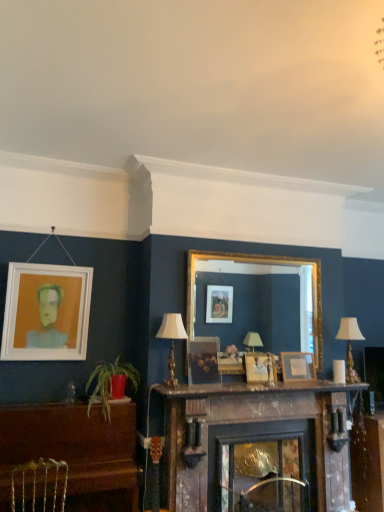
How much space does wooden picture frame at center, which is the third picture frame from left to right, occupy vertically?

wooden picture frame at center, which is the third picture frame from left to right, is 12.97 inches tall.

Describe the element at coordinates (172, 341) in the screenshot. I see `white fabric lampshade at center, which appears as the first lamp when viewed from the front` at that location.

In order to face matte wooden picture frame at center, the third picture frame in the right-to-left sequence, should I rotate leftwards or rightwards?

Turn right by 1.745 degrees to look at matte wooden picture frame at center, the third picture frame in the right-to-left sequence.

Describe the element at coordinates (75, 451) in the screenshot. The width and height of the screenshot is (384, 512). I see `brown polished piano at lower left` at that location.

Describe the element at coordinates (109, 382) in the screenshot. I see `green leafy plant at lower left` at that location.

Measure the distance between point (282,509) and camera.

A distance of 3.51 meters exists between point (282,509) and camera.

Where is `wooden mantle at center`? wooden mantle at center is located at coordinates [x=255, y=389].

Identify the location of swivel chair below the green leafy plant at lower left (from a real-world perspective). The width and height of the screenshot is (384, 512). (39, 486).

Is green leafy plant at lower left spatially inside metallic silver swivel chair at lower left, or outside of it?

green leafy plant at lower left is not inside metallic silver swivel chair at lower left, it's outside.

Does green leafy plant at lower left have a lesser width compared to metallic silver swivel chair at lower left?

In fact, green leafy plant at lower left might be wider than metallic silver swivel chair at lower left.

Is matte wooden picture frame at center, which is counted as the 2th picture frame, starting from the left, behind wooden picture frame at center, the 4th picture frame in the left-to-right sequence?

No, it is not.

The image size is (384, 512). There is a wooden picture frame at center, the 4th picture frame in the left-to-right sequence. In order to click on the 1st picture frame above it (from a real-world perspective) in this screenshot , I will do `click(203, 360)`.

Looking at this image, is matte wooden picture frame at center, the third picture frame in the right-to-left sequence, positioned far away from wooden picture frame at center, the 4th picture frame in the left-to-right sequence?

matte wooden picture frame at center, the third picture frame in the right-to-left sequence, is near wooden picture frame at center, the 4th picture frame in the left-to-right sequence, not far away.

Is matte wooden picture frame at center, the third picture frame in the right-to-left sequence, to the right of wooden mantle at center from the viewer's perspective?

No, matte wooden picture frame at center, the third picture frame in the right-to-left sequence, is not to the right of wooden mantle at center.

Looking at this image, from a real-world perspective, which object stands above the other?

matte wooden picture frame at center, the third picture frame in the right-to-left sequence.

Is matte wooden picture frame at center, which is counted as the 2th picture frame, starting from the left, facing away from wooden mantle at center?

matte wooden picture frame at center, which is counted as the 2th picture frame, starting from the left, is not turned away from wooden mantle at center.

From the image's perspective, starting from the wooden mantle at center, which picture frame is the 3rd one above? Please provide its 2D coordinates.

[(203, 360)]

Is white fabric lampshade at center, acting as the 1th lamp starting from the left, positioned with its back to wooden picture frame at center, which is the third picture frame from left to right?

No, white fabric lampshade at center, acting as the 1th lamp starting from the left,'s orientation is not away from wooden picture frame at center, which is the third picture frame from left to right.

Can you confirm if white fabric lampshade at center, which appears as the first lamp when viewed from the front, is taller than wooden picture frame at center, arranged as the 2th picture frame when viewed from the right?

Yes.

Which is more to the left, white fabric lampshade at center, which appears as the first lamp when viewed from the front, or wooden picture frame at center, arranged as the 2th picture frame when viewed from the right?

white fabric lampshade at center, which appears as the first lamp when viewed from the front, is more to the left.

Based on the photo, is white fabric lampshade at center, acting as the 1th lamp starting from the left, thinner than wooden picture frame at center, arranged as the 2th picture frame when viewed from the right?

No, white fabric lampshade at center, acting as the 1th lamp starting from the left, is not thinner than wooden picture frame at center, arranged as the 2th picture frame when viewed from the right.

Considering the points (183, 330) and (286, 370), which point is in front, point (183, 330) or point (286, 370)?

The point (183, 330) is in front.

Is white fabric lampshade at center, which appears as the first lamp when viewed from the front, next to wooden picture frame at center, positioned as the 1th picture frame in right-to-left order?

They are not placed beside each other.

Starting from the white fabric lampshade at center, acting as the 1th lamp starting from the left, which picture frame is the 3rd one to the right? Please provide its 2D coordinates.

[(297, 367)]

Which object is further away from the camera, white fabric lampshade at center, which appears as the first lamp when viewed from the front, or wooden picture frame at center, the 4th picture frame in the left-to-right sequence?

wooden picture frame at center, the 4th picture frame in the left-to-right sequence, is behind.

Which is correct: white fabric lampshade at right, the second lamp viewed from the left, is inside wooden mantle at center, or outside of it?

white fabric lampshade at right, the second lamp viewed from the left, is located beyond the bounds of wooden mantle at center.

Is white fabric lampshade at right, the 1th lamp when ordered from back to front, next to wooden mantle at center?

No, white fabric lampshade at right, the 1th lamp when ordered from back to front, is not in contact with wooden mantle at center.

Is white fabric lampshade at right, the 2th lamp when ordered from front to back, bigger than wooden mantle at center?

Incorrect, white fabric lampshade at right, the 2th lamp when ordered from front to back, is not larger than wooden mantle at center.

Measure the distance between white fabric lampshade at right, the 2th lamp when ordered from front to back, and wooden mantle at center.

white fabric lampshade at right, the 2th lamp when ordered from front to back, is 80.66 centimeters from wooden mantle at center.

Considering the sizes of objects matte wooden picture frame at center, the third picture frame in the right-to-left sequence, and green leafy plant at lower left in the image provided, who is thinner, matte wooden picture frame at center, the third picture frame in the right-to-left sequence, or green leafy plant at lower left?

With smaller width is matte wooden picture frame at center, the third picture frame in the right-to-left sequence.

Between matte wooden picture frame at center, the third picture frame in the right-to-left sequence, and green leafy plant at lower left, which one appears on the left side from the viewer's perspective?

green leafy plant at lower left.

Between point (218, 344) and point (97, 365), which one is positioned behind?

The point (218, 344) is behind.

Based on the photo, from a real-world perspective, is matte wooden picture frame at center, the third picture frame in the right-to-left sequence, under green leafy plant at lower left?

No, from a real-world perspective, matte wooden picture frame at center, the third picture frame in the right-to-left sequence, is not beneath green leafy plant at lower left.

Where is `swivel chair lying below the green leafy plant at lower left (from the image's perspective)`? The width and height of the screenshot is (384, 512). swivel chair lying below the green leafy plant at lower left (from the image's perspective) is located at coordinates (39, 486).

What are the coordinates of `picture frame that is the 2nd object to the right of the matte wooden picture frame at center, the third picture frame in the right-to-left sequence, starting at the anchor` in the screenshot? It's located at (297, 367).

When comparing their distances from metallic silver swivel chair at lower left, does white fabric lampshade at right, arranged as the 1th lamp when viewed from the right, or wooden mantle at center seem closer?

The object closer to metallic silver swivel chair at lower left is wooden mantle at center.

Based on their spatial positions, is green leafy plant at lower left or wooden picture frame at center, which is the third picture frame from left to right, closer to wooden mantle at center?

wooden picture frame at center, which is the third picture frame from left to right, is positioned closer to the anchor wooden mantle at center.

Considering their positions, is wooden picture frame at center, positioned as the 1th picture frame in right-to-left order, positioned further to green leafy plant at lower left than metallic silver swivel chair at lower left?

Among the two, wooden picture frame at center, positioned as the 1th picture frame in right-to-left order, is located further to green leafy plant at lower left.

Which object lies nearer to the anchor point white fabric lampshade at right, arranged as the 1th lamp when viewed from the right, green leafy plant at lower left or brown polished piano at lower left?

Based on the image, green leafy plant at lower left appears to be nearer to white fabric lampshade at right, arranged as the 1th lamp when viewed from the right.

From the image, which object appears to be nearer to wooden picture frame at center, which is the third picture frame from left to right, brown polished piano at lower left or wooden mantle at center?

Based on the image, wooden mantle at center appears to be nearer to wooden picture frame at center, which is the third picture frame from left to right.

Looking at the image, which one is located closer to wooden picture frame at center, arranged as the 2th picture frame when viewed from the right, green leafy plant at lower left or wooden picture frame at center, positioned as the 1th picture frame in right-to-left order?

Among the two, wooden picture frame at center, positioned as the 1th picture frame in right-to-left order, is located nearer to wooden picture frame at center, arranged as the 2th picture frame when viewed from the right.

Based on their spatial positions, is wooden table at lower right or white fabric lampshade at right, the 2th lamp when ordered from front to back, further from white fabric lampshade at center, acting as the 1th lamp starting from the left?

wooden table at lower right lies further to white fabric lampshade at center, acting as the 1th lamp starting from the left, than the other object.

Which object lies nearer to the anchor point wooden picture frame at center, the 4th picture frame in the left-to-right sequence, white fabric lampshade at right, arranged as the 1th lamp when viewed from the right, or matte wooden picture frame at center, the third picture frame in the right-to-left sequence?

Among the two, white fabric lampshade at right, arranged as the 1th lamp when viewed from the right, is located nearer to wooden picture frame at center, the 4th picture frame in the left-to-right sequence.

Find the location of a particular element. picture frame between green leafy plant at lower left and wooden picture frame at center, which is the third picture frame from left to right, in the horizontal direction is located at coordinates (203, 360).

Locate an element on the screen. The width and height of the screenshot is (384, 512). lamp situated between metallic silver swivel chair at lower left and gold-framed mirror at center from left to right is located at coordinates (172, 341).

At what (x,y) coordinates should I click in order to perform the action: click on houseplant between white matte picture frame at upper left, acting as the first picture frame starting from the left, and matte wooden picture frame at center, which is counted as the 2th picture frame, starting from the left, in the horizontal direction. Please return your answer as a coordinate pair (x, y). This screenshot has height=512, width=384. Looking at the image, I should click on (109, 382).

Identify the location of mirror between metallic silver swivel chair at lower left and wooden mantle at center. The height and width of the screenshot is (512, 384). (258, 304).